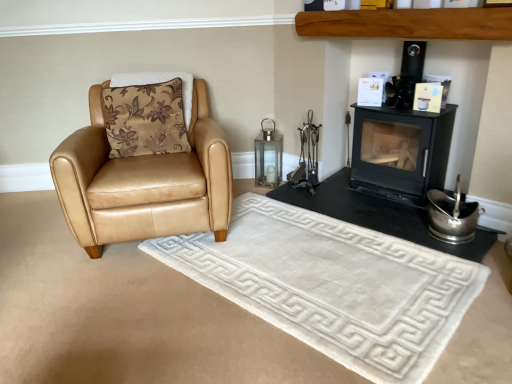
Question: Is black matte fireplace at right bigger than white plush rug at center?

Choices:
 (A) no
 (B) yes

Answer: (A)

Question: Is black matte fireplace at right aimed at white plush rug at center?

Choices:
 (A) yes
 (B) no

Answer: (A)

Question: Considering the relative sizes of black matte fireplace at right and white plush rug at center in the image provided, is black matte fireplace at right thinner than white plush rug at center?

Choices:
 (A) no
 (B) yes

Answer: (B)

Question: Does black matte fireplace at right have a lesser height compared to white plush rug at center?

Choices:
 (A) yes
 (B) no

Answer: (A)

Question: Is white plush rug at center at the back of black matte fireplace at right?

Choices:
 (A) no
 (B) yes

Answer: (A)

Question: Is black matte fireplace at right positioned before white plush rug at center?

Choices:
 (A) no
 (B) yes

Answer: (A)

Question: Is brown floral fabric pillow at left located within black matte wood burning stove at upper right?

Choices:
 (A) no
 (B) yes

Answer: (A)

Question: Is black matte wood burning stove at upper right oriented away from brown floral fabric pillow at left?

Choices:
 (A) yes
 (B) no

Answer: (B)

Question: From a real-world perspective, is black matte wood burning stove at upper right physically above brown floral fabric pillow at left?

Choices:
 (A) yes
 (B) no

Answer: (B)

Question: From a real-world perspective, is black matte wood burning stove at upper right below brown floral fabric pillow at left?

Choices:
 (A) no
 (B) yes

Answer: (B)

Question: Is black matte wood burning stove at upper right not close to brown floral fabric pillow at left?

Choices:
 (A) yes
 (B) no

Answer: (A)

Question: Does black matte wood burning stove at upper right have a lesser width compared to brown floral fabric pillow at left?

Choices:
 (A) no
 (B) yes

Answer: (B)

Question: Considering the relative sizes of black matte fireplace at right and tan leather armchair at left in the image provided, is black matte fireplace at right shorter than tan leather armchair at left?

Choices:
 (A) no
 (B) yes

Answer: (B)